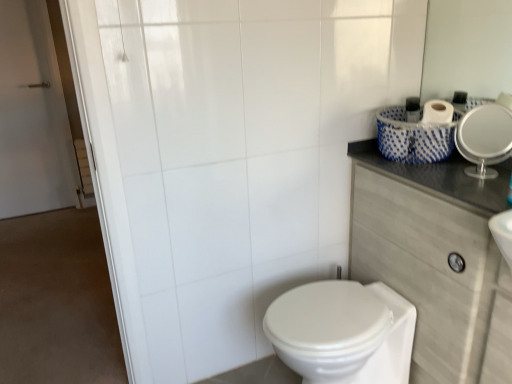
This screenshot has width=512, height=384. Identify the location of free space above white glossy bidet at lower center (from a real-world perspective). (328, 303).